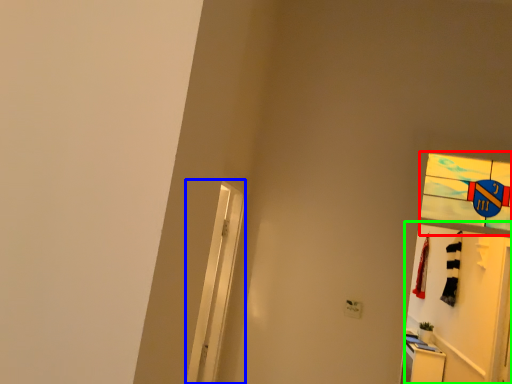
Question: Estimate the real-world distances between objects in this image. Which object is closer to glass window (highlighted by a red box), screen door (highlighted by a blue box) or door (highlighted by a green box)?

Choices:
 (A) screen door
 (B) door

Answer: (A)